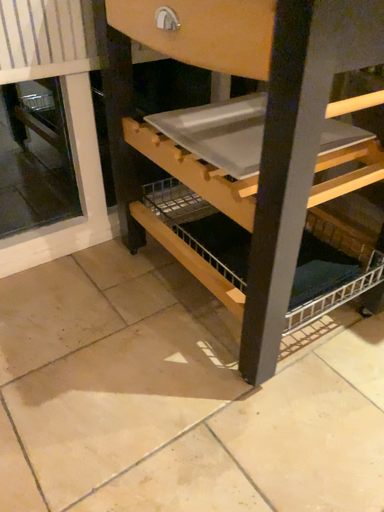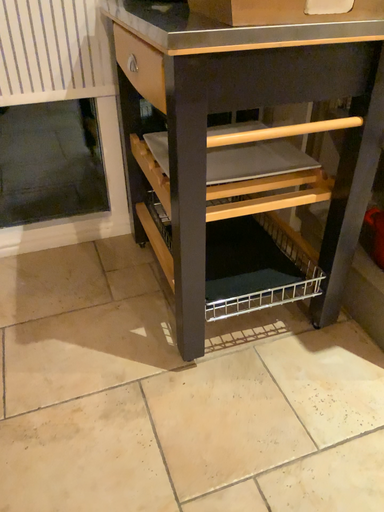
Question: How did the camera likely rotate when shooting the video?

Choices:
 (A) rotated left
 (B) rotated right

Answer: (A)